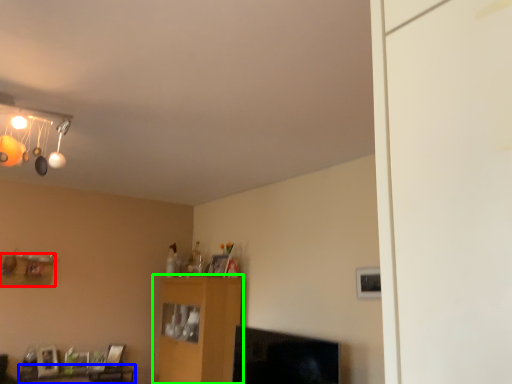
Question: Considering the real-world distances, which object is closest to shelf (highlighted by a red box)? table (highlighted by a blue box) or furniture (highlighted by a green box).

Choices:
 (A) table
 (B) furniture

Answer: (A)